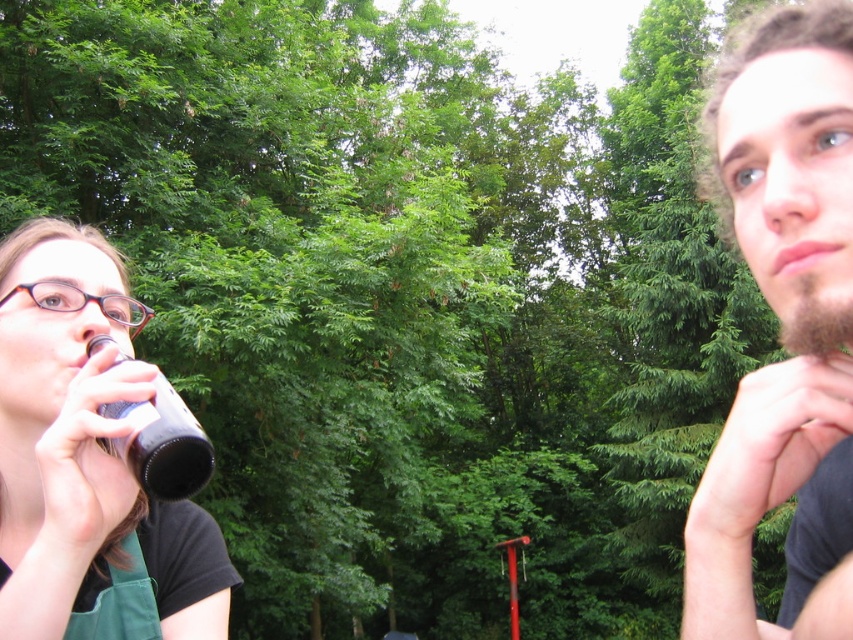
Question: Is dark brown beard at right positioned behind black matte bottle at left?

Choices:
 (A) no
 (B) yes

Answer: (A)

Question: Which object is the closest to the matte black bottle at left?

Choices:
 (A) dark brown beard at right
 (B) black matte bottle at left

Answer: (B)

Question: Where is dark brown beard at right located in relation to matte black bottle at left in the image?

Choices:
 (A) above
 (B) below

Answer: (A)

Question: Is dark brown beard at right positioned behind black matte bottle at left?

Choices:
 (A) yes
 (B) no

Answer: (B)

Question: Among these points, which one is nearest to the camera?

Choices:
 (A) (212, 468)
 (B) (764, 244)
 (C) (51, 294)

Answer: (B)

Question: Which of the following is the closest to the observer?

Choices:
 (A) matte black bottle at left
 (B) dark brown beard at right
 (C) black matte bottle at left

Answer: (B)